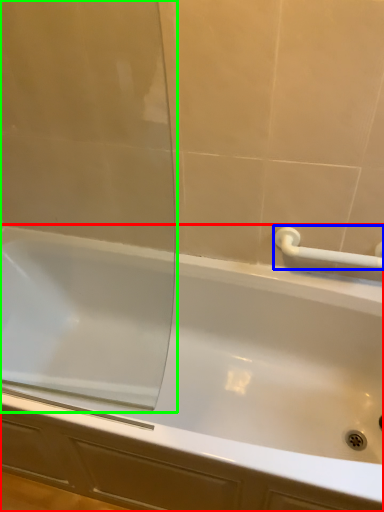
Question: Which object is the closest to the bathtub (highlighted by a red box)? Choose among these: towel bar (highlighted by a blue box) or screen door (highlighted by a green box).

Choices:
 (A) towel bar
 (B) screen door

Answer: (B)